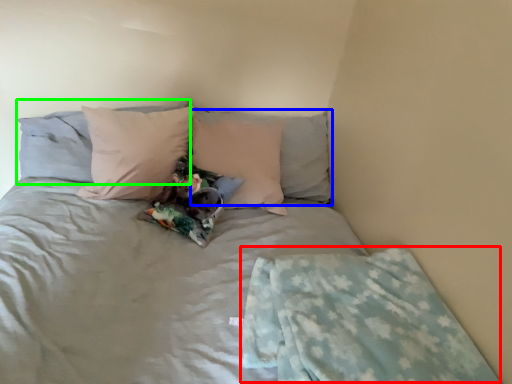
Question: Which object is the farthest from blanket (highlighted by a red box)? Choose among these: pillow (highlighted by a blue box) or pillow (highlighted by a green box).

Choices:
 (A) pillow
 (B) pillow

Answer: (B)